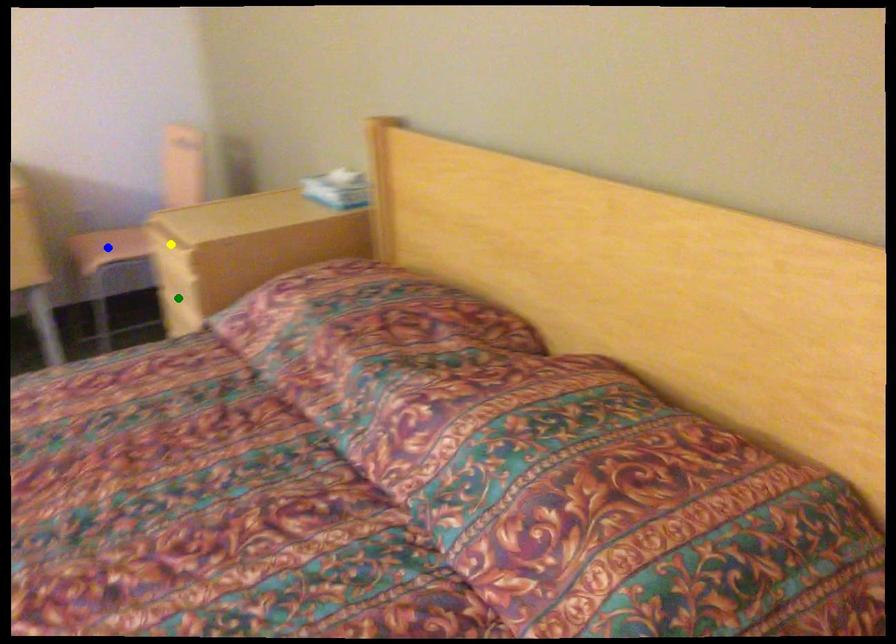
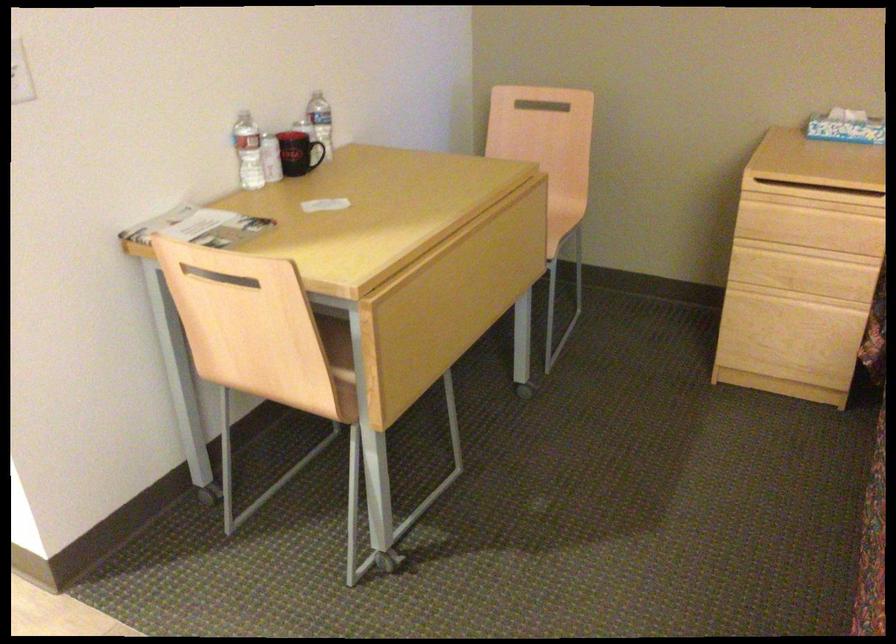
I am providing you with two images of the same scene from different viewpoints. Three points are marked in image1. Which point corresponds to a part or object that is occluded in image2?In image1, three points are marked. Which of them correspond to a part or object that is occluded in image2?Among the three points shown in image1, which one corresponds to a part or object that is no longer visible due to occlusion in image2?

blue point cannot be seen in image2.